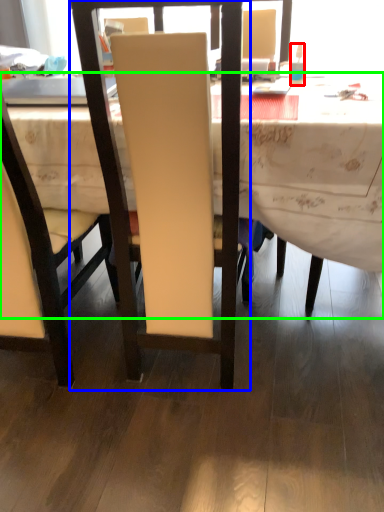
Question: Which object is positioned farthest from bottle (highlighted by a red box)? Select from chair (highlighted by a blue box) and desk (highlighted by a green box).

Choices:
 (A) chair
 (B) desk

Answer: (A)